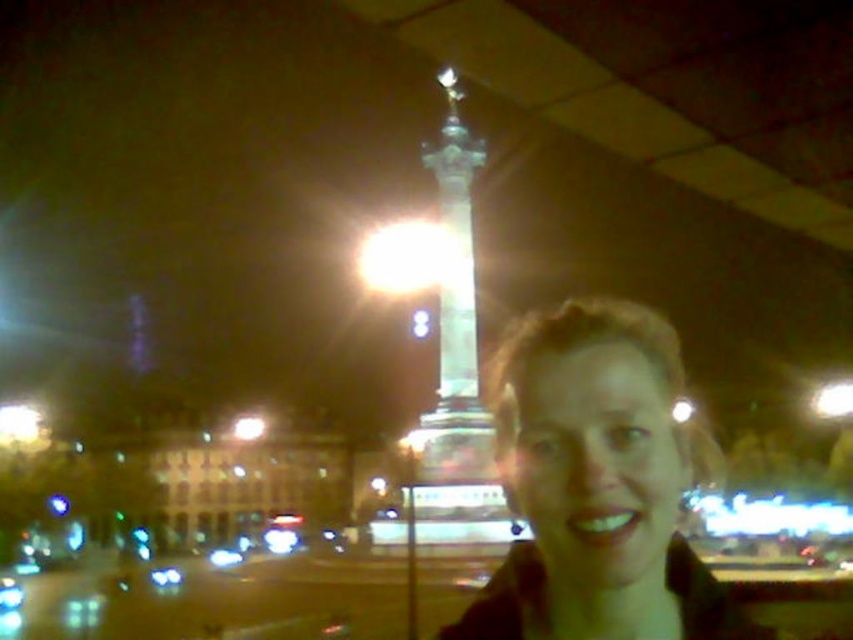
Question: Which point appears closest to the camera in this image?

Choices:
 (A) (457, 179)
 (B) (572, 497)

Answer: (B)

Question: Which point is closer to the camera taking this photo?

Choices:
 (A) (428, 420)
 (B) (656, 563)

Answer: (B)

Question: Can you confirm if matte brown hair at center is thinner than shiny metallic column at center?

Choices:
 (A) no
 (B) yes

Answer: (A)

Question: In this image, where is matte brown hair at center located relative to shiny metallic column at center?

Choices:
 (A) below
 (B) above

Answer: (A)

Question: Is matte brown hair at center to the right of shiny metallic column at center from the viewer's perspective?

Choices:
 (A) yes
 (B) no

Answer: (A)